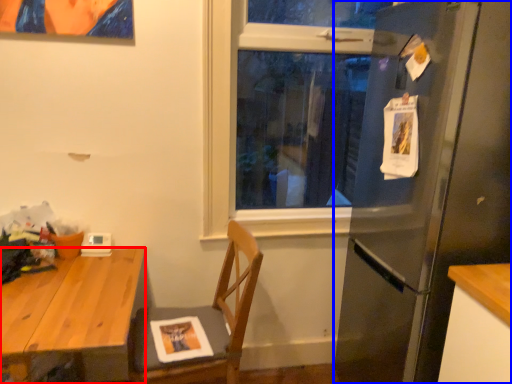
Question: Which object appears farthest to the camera in this image, desk (highlighted by a red box) or refrigerator (highlighted by a blue box)?

Choices:
 (A) desk
 (B) refrigerator

Answer: (B)